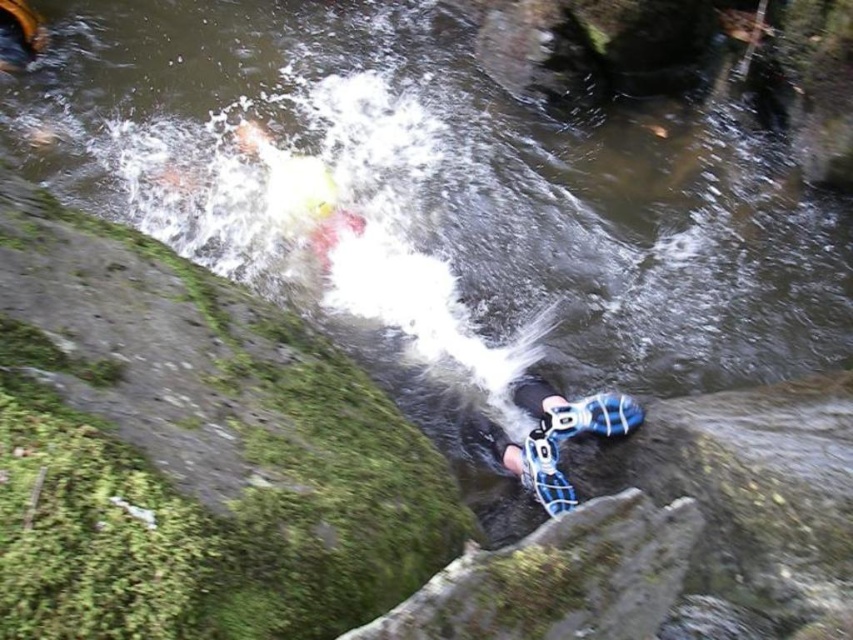
Question: Is blue mesh shoes at lower center positioned in front of blue mesh shoe at lower center?

Choices:
 (A) yes
 (B) no

Answer: (B)

Question: Is the position of blue mesh shoes at lower center more distant than that of blue mesh shoe at lower center?

Choices:
 (A) no
 (B) yes

Answer: (B)

Question: Does blue mesh shoes at lower center appear under blue mesh shoe at lower center?

Choices:
 (A) yes
 (B) no

Answer: (A)

Question: Which object is closer to the camera taking this photo?

Choices:
 (A) blue mesh shoe at lower center
 (B) blue mesh shoes at lower center

Answer: (A)

Question: Which of the following is the closest to the observer?

Choices:
 (A) blue mesh shoes at lower center
 (B) blue mesh shoe at lower center

Answer: (B)

Question: Among these objects, which one is farthest from the camera?

Choices:
 (A) blue mesh shoe at lower center
 (B) blue mesh shoes at lower center

Answer: (B)